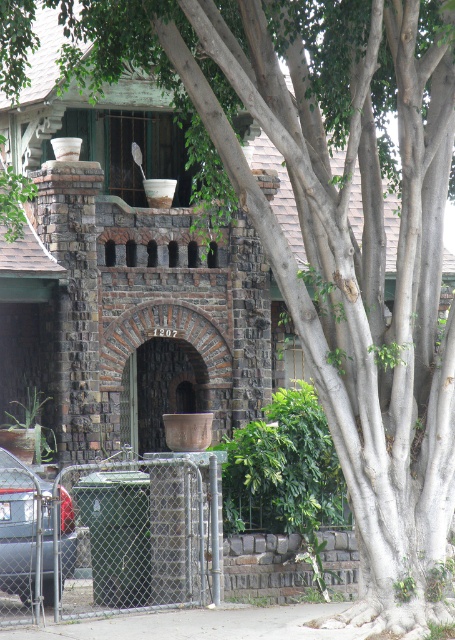
Question: Is metal chain-link fence at lower center smaller than matte black car at lower left?

Choices:
 (A) yes
 (B) no

Answer: (B)

Question: Does metal chain-link fence at lower center come behind matte black car at lower left?

Choices:
 (A) no
 (B) yes

Answer: (A)

Question: Which of the following is the farthest from the observer?

Choices:
 (A) matte black car at lower left
 (B) metal chain-link fence at lower center

Answer: (A)

Question: Among these objects, which one is farthest from the camera?

Choices:
 (A) matte black car at lower left
 (B) metal chain-link fence at lower center

Answer: (A)

Question: Is metal chain-link fence at lower center to the right of matte black car at lower left from the viewer's perspective?

Choices:
 (A) yes
 (B) no

Answer: (A)